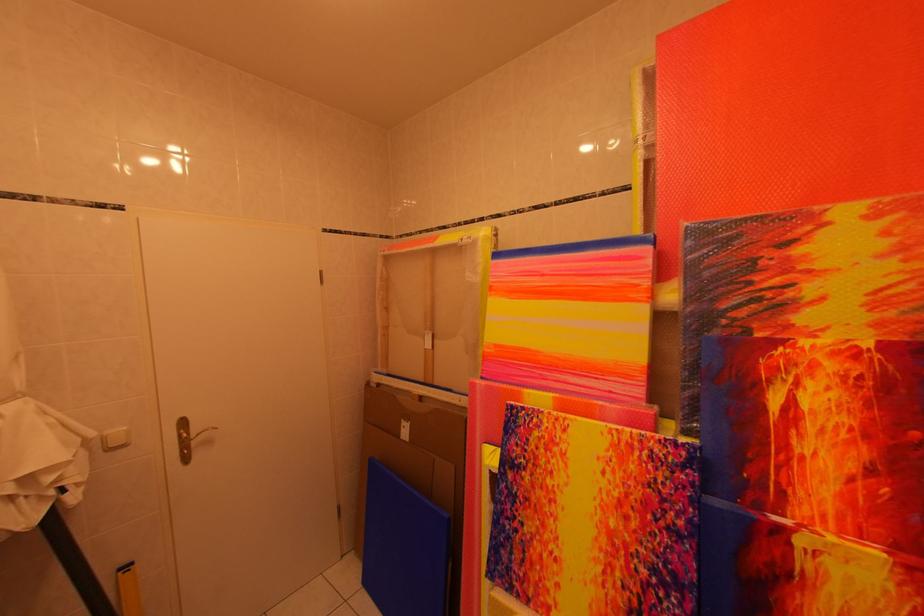
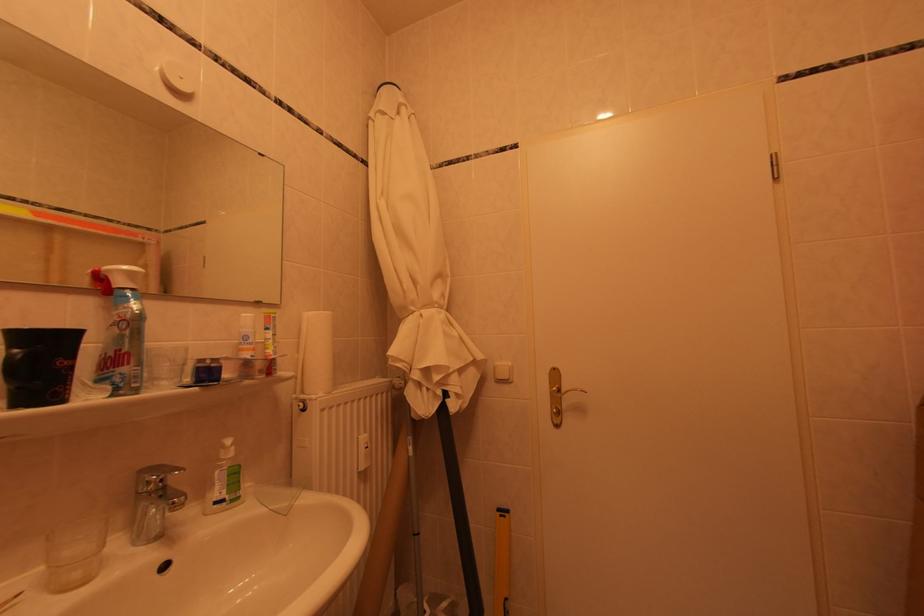
In the second image, find the point that corresponds to [116,437] in the first image.

(506, 367)